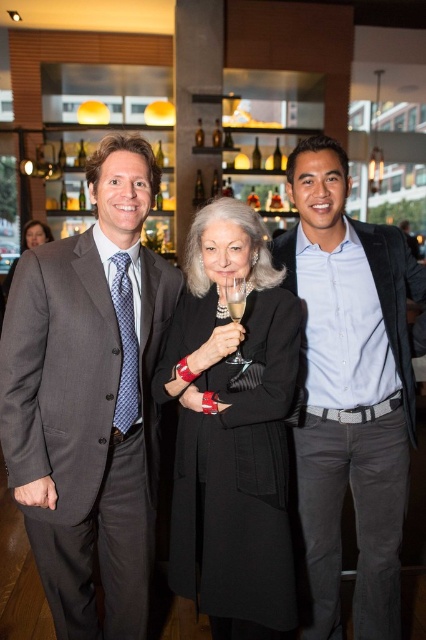
Question: Which is farther from the matte gray suit at left?

Choices:
 (A) black wool coat at center
 (B) clear glass wine at center

Answer: (B)

Question: Is light blue shirt at center wider than clear glass wine at center?

Choices:
 (A) no
 (B) yes

Answer: (B)

Question: Does matte gray suit at left have a smaller size compared to clear glass wine at center?

Choices:
 (A) yes
 (B) no

Answer: (B)

Question: Among these points, which one is nearest to the camera?

Choices:
 (A) (242, 307)
 (B) (328, 612)

Answer: (A)

Question: Does light blue shirt at center have a smaller size compared to clear glass wine at center?

Choices:
 (A) yes
 (B) no

Answer: (B)

Question: Which object appears farthest from the camera in this image?

Choices:
 (A) light blue shirt at center
 (B) black wool coat at center
 (C) matte black coat at center

Answer: (C)